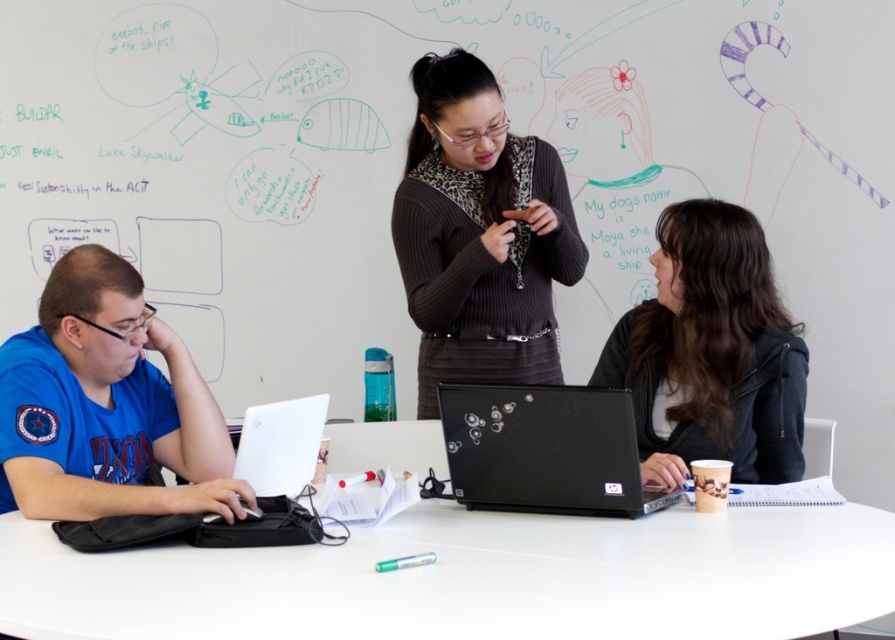
You are a person sitting at the white glossy table at center. You want to place your black glossy laptop at center on the table. Is the table tall enough to support the laptop?

The white glossy table at center is not as tall as the black glossy laptop at center, so the table is shorter than the laptop. Therefore, the table cannot support the laptop because it is shorter than the laptop.

You are standing at the entrance of the room and want to walk directly to the white glossy table at center. Based on the coordinates provided, in which direction should you move from your current position?

The white glossy table at center is located at coordinates point (474, 579), so you should move towards the direction of the center of the room to reach it.

You need to place both the matte black sweater at center and the black matte jacket at center into a rectangular drawer. The drawer has a width of 10 cm. If the sweater is wider than the jacket, will both items fit side by side?

The matte black sweater at center might be wider than black matte jacket at center. Since the sweater could be wider, it is uncertain if both will fit in the 10 cm drawer. Check their combined width before placing them.